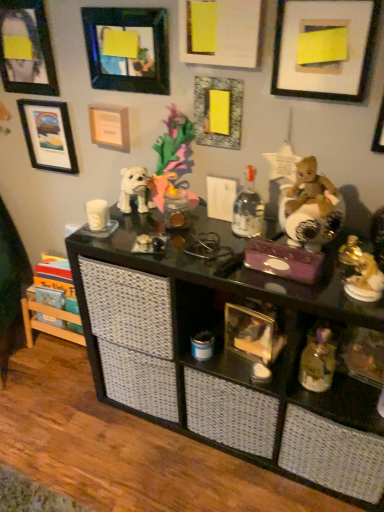
In order to click on vacant area that is in front of shiny gold bear at right, the fourth toy positioned from the bottom in this screenshot , I will do `click(319, 288)`.